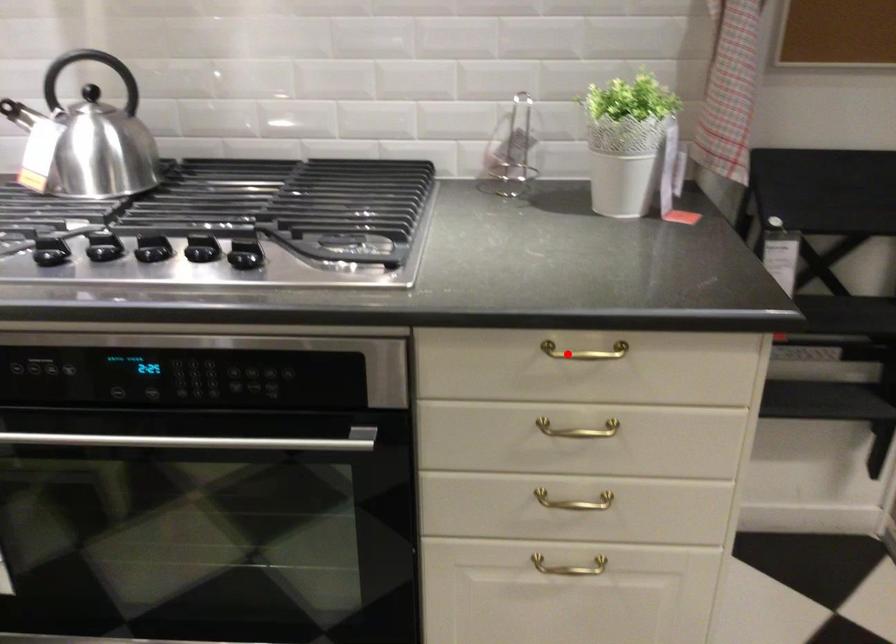
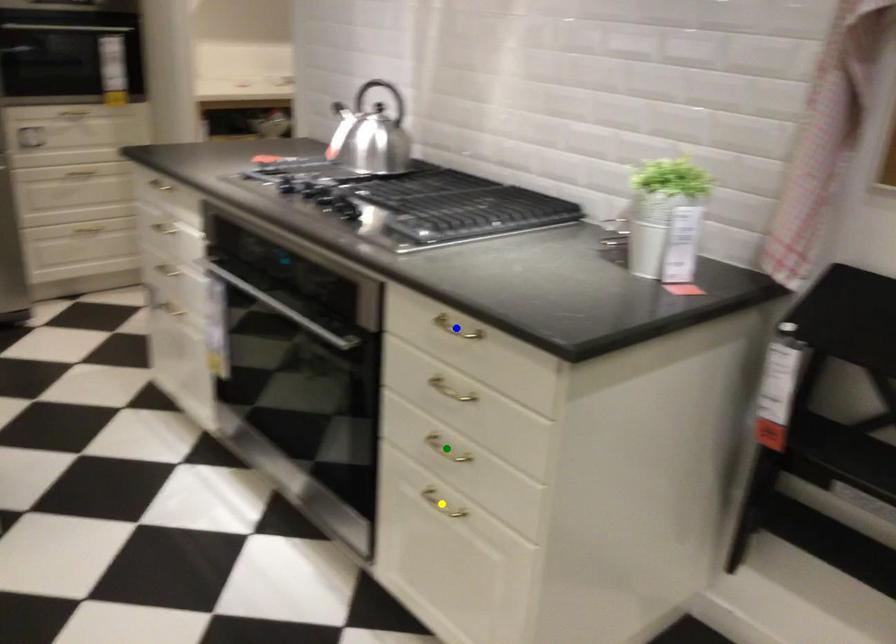
Question: I am providing you with two images of the same scene from different viewpoints. A red point is marked on the first image. You are given multiple points on the second image. Which point in image 2 is actually the same real-world point as the red point in image 1?

Choices:
 (A) blue point
 (B) yellow point
 (C) green point

Answer: (A)